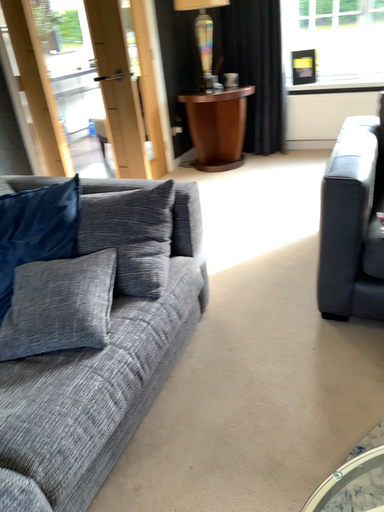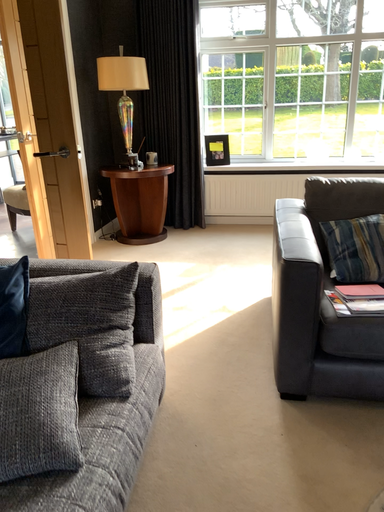
Question: How did the camera likely rotate when shooting the video?

Choices:
 (A) rotated upward
 (B) rotated downward

Answer: (A)